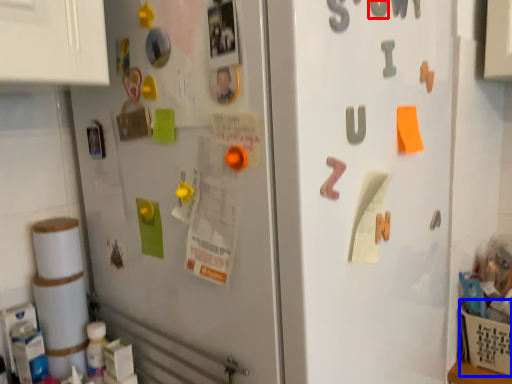
Question: Which of the following is the farthest to the observer, number (highlighted by a red box) or basket (highlighted by a blue box)?

Choices:
 (A) number
 (B) basket

Answer: (B)